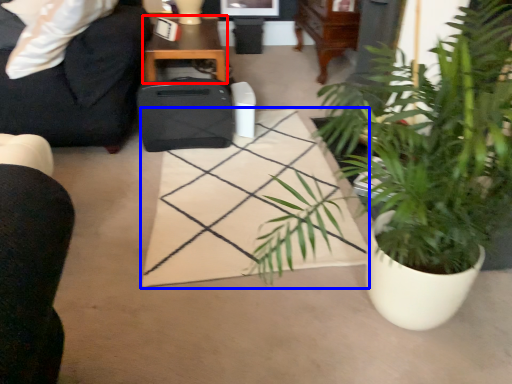
Question: Which of the following is the closest to the observer, table (highlighted by a red box) or plain (highlighted by a blue box)?

Choices:
 (A) table
 (B) plain

Answer: (B)